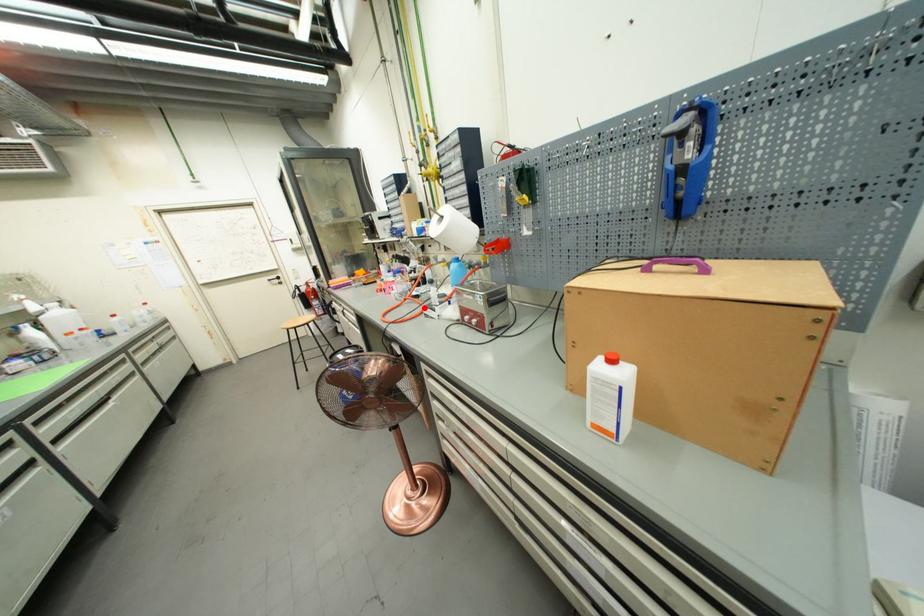
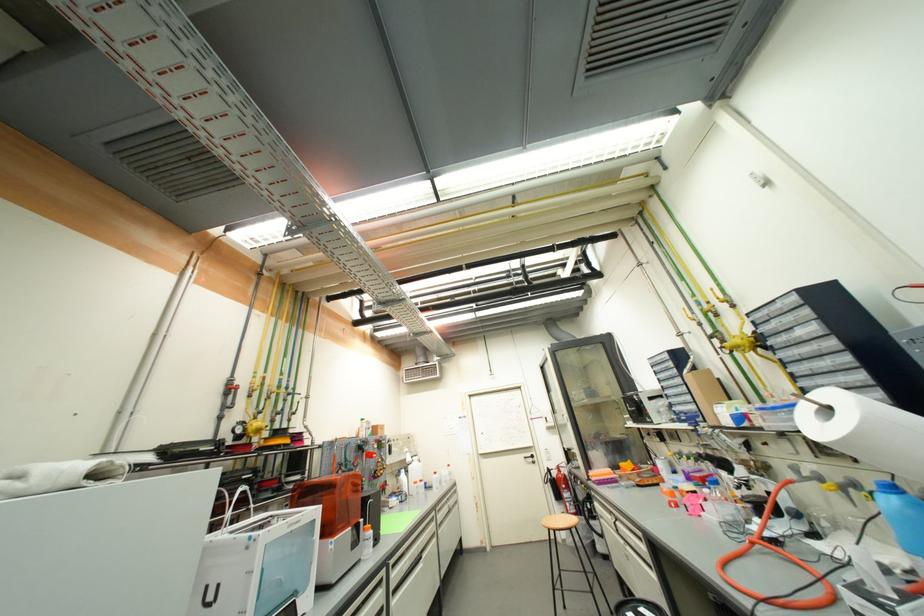
Where in the second image is the point corresponding to the highlighted location from the first image?

(817, 578)